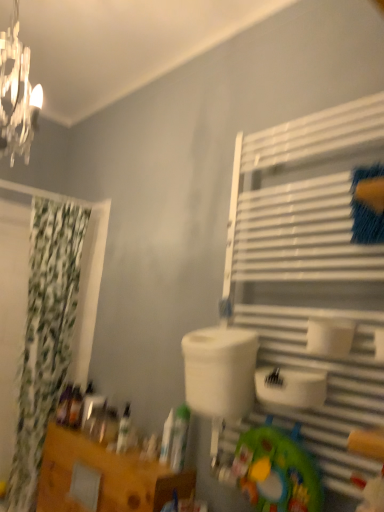
Where is `vacant area that is in front of white matte bottle at center, the 4th toiletry when ordered from left to right`? The image size is (384, 512). vacant area that is in front of white matte bottle at center, the 4th toiletry when ordered from left to right is located at coordinates (165, 468).